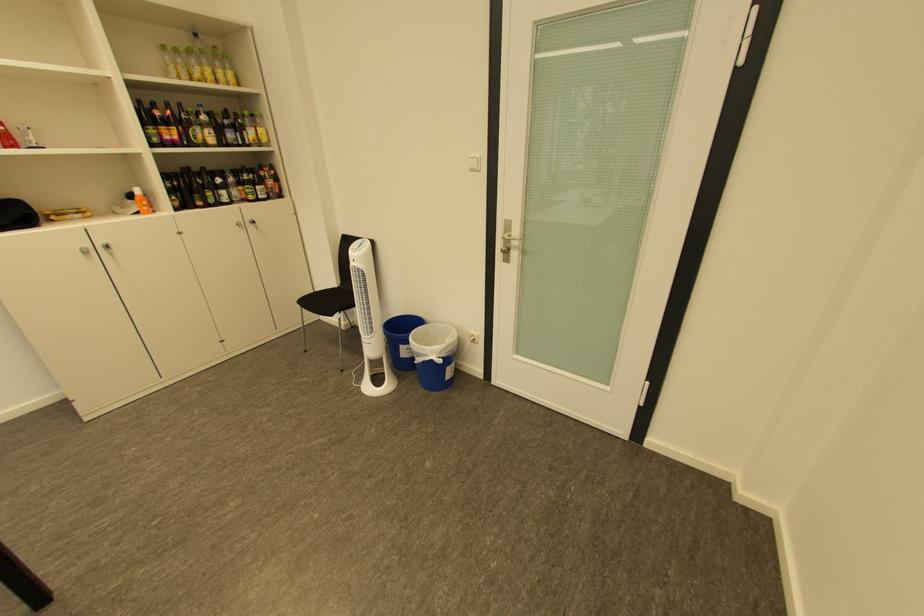
Find where to lift the blue bucket. Please return your answer as a coordinate pair (x, y).

(433, 355)